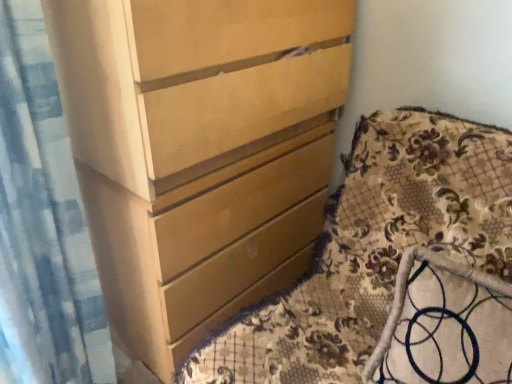
Question: From the image's perspective, is blue textured fabric at left above matte wood chest of drawers at center?

Choices:
 (A) yes
 (B) no

Answer: (B)

Question: Does blue textured fabric at left appear on the right side of matte wood chest of drawers at center?

Choices:
 (A) yes
 (B) no

Answer: (B)

Question: Can you confirm if blue textured fabric at left is shorter than matte wood chest of drawers at center?

Choices:
 (A) no
 (B) yes

Answer: (B)

Question: Is blue textured fabric at left oriented away from matte wood chest of drawers at center?

Choices:
 (A) yes
 (B) no

Answer: (B)

Question: Is blue textured fabric at left bigger than matte wood chest of drawers at center?

Choices:
 (A) no
 (B) yes

Answer: (A)

Question: Can we say blue textured fabric at left lies outside matte wood chest of drawers at center?

Choices:
 (A) no
 (B) yes

Answer: (B)

Question: Considering the relative sizes of matte wood chest of drawers at center and floral fabric cushion at lower right in the image provided, is matte wood chest of drawers at center wider than floral fabric cushion at lower right?

Choices:
 (A) yes
 (B) no

Answer: (A)

Question: Can you confirm if matte wood chest of drawers at center is bigger than floral fabric cushion at lower right?

Choices:
 (A) yes
 (B) no

Answer: (A)

Question: Can you confirm if matte wood chest of drawers at center is smaller than floral fabric cushion at lower right?

Choices:
 (A) no
 (B) yes

Answer: (A)

Question: Is matte wood chest of drawers at center positioned with its back to floral fabric cushion at lower right?

Choices:
 (A) no
 (B) yes

Answer: (B)

Question: Is matte wood chest of drawers at center outside of floral fabric cushion at lower right?

Choices:
 (A) no
 (B) yes

Answer: (B)

Question: Would you say matte wood chest of drawers at center contains floral fabric cushion at lower right?

Choices:
 (A) no
 (B) yes

Answer: (A)

Question: Is matte wood chest of drawers at center closer to camera compared to blue textured fabric at left?

Choices:
 (A) yes
 (B) no

Answer: (B)